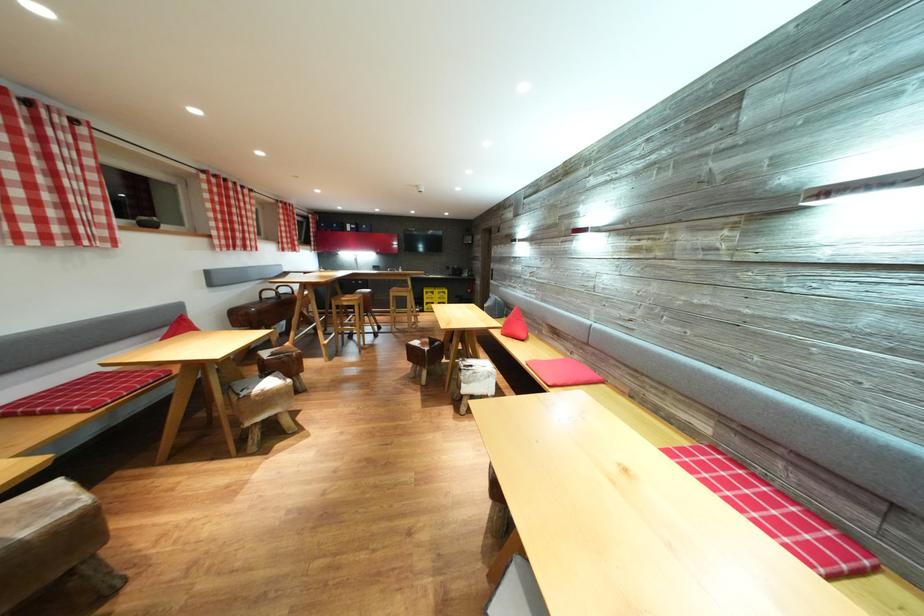
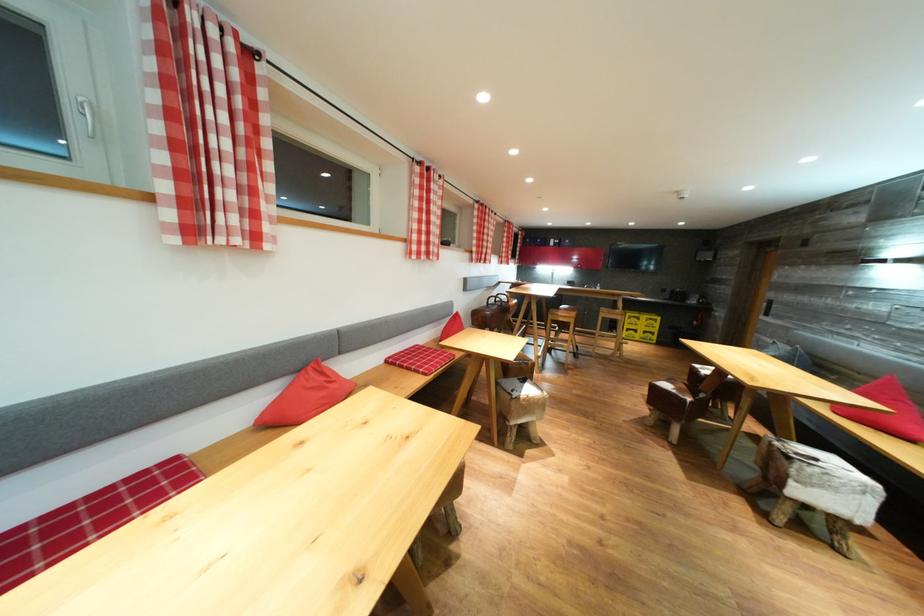
Locate, in the second image, the point that corresponds to [351,309] in the first image.

(567, 325)